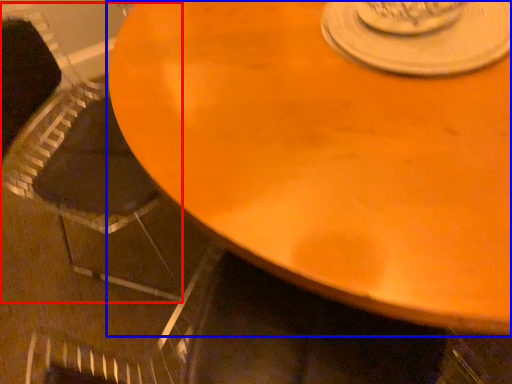
Question: Which object appears closest to the camera in this image, armchair (highlighted by a red box) or table (highlighted by a blue box)?

Choices:
 (A) armchair
 (B) table

Answer: (B)